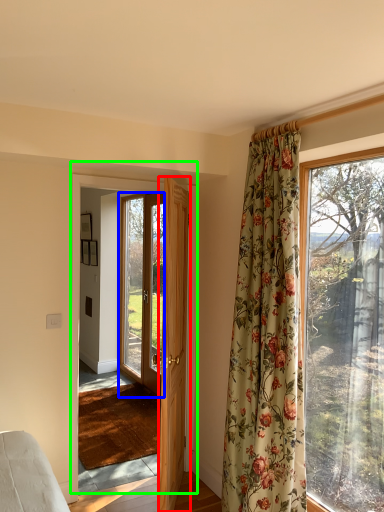
Question: Which is farther away from door (highlighted by a red box)? door (highlighted by a blue box) or door (highlighted by a green box)?

Choices:
 (A) door
 (B) door

Answer: (A)